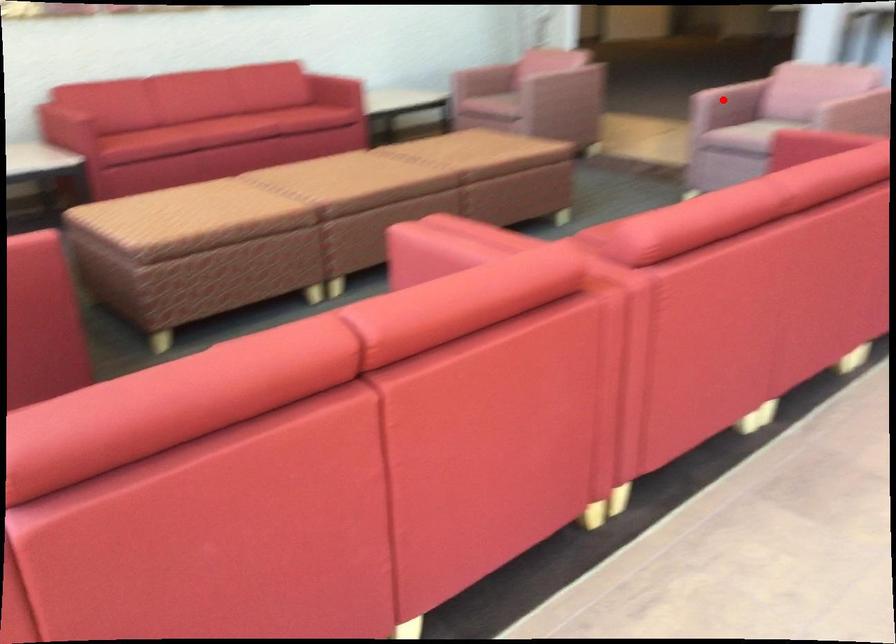
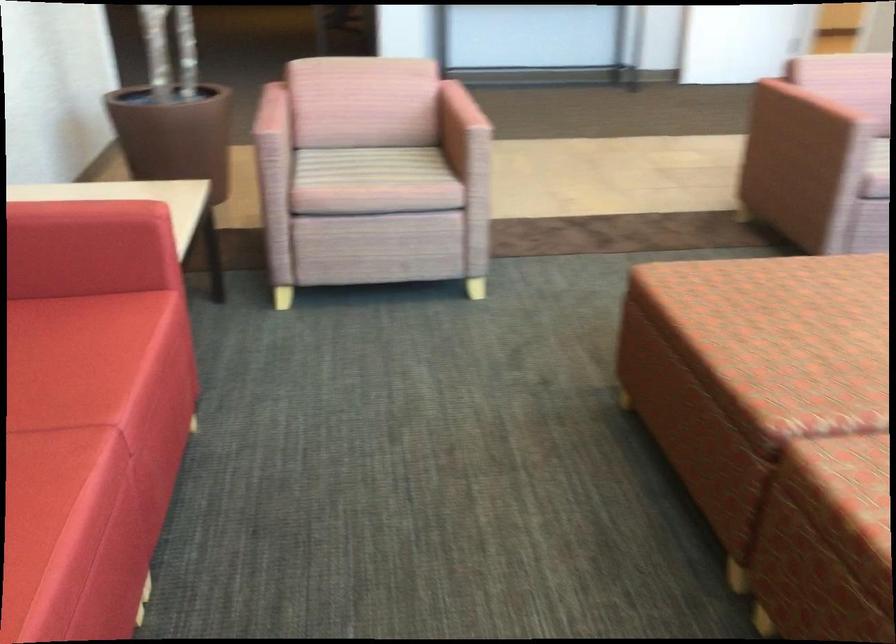
Question: I am providing you with two images of the same scene from different viewpoints. Image1 has a red point marked. In image2, the corresponding 3D location appears at what relative position? Reply with the corresponding letter.

Choices:
 (A) Closer
 (B) Farther

Answer: (A)